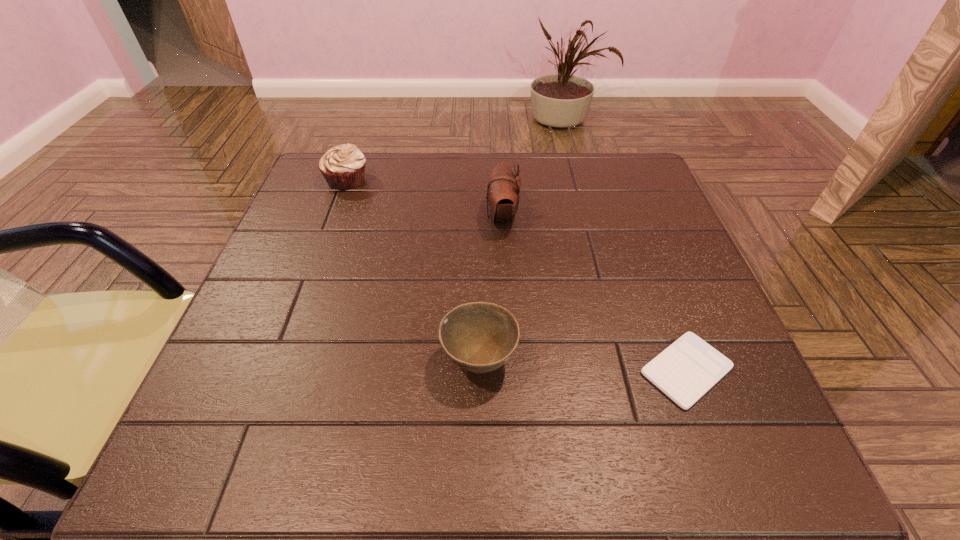
Identify the location of free space at the left edge of the desktop. The width and height of the screenshot is (960, 540). (262, 271).

The image size is (960, 540). I want to click on vacant space at the right edge of the desktop, so click(684, 326).

Identify the location of vacant space at the far left corner of the desktop. (361, 190).

The image size is (960, 540). I want to click on blank space at the near left corner of the desktop, so click(223, 468).

Where is `free area in between the tallest object and the muffin`? The image size is (960, 540). free area in between the tallest object and the muffin is located at coordinates (424, 198).

I want to click on free space between the rightmost object and the leftmost object, so click(x=516, y=275).

The height and width of the screenshot is (540, 960). What are the coordinates of `blank region between the farthest object and the bowl` in the screenshot? It's located at (413, 270).

This screenshot has height=540, width=960. What are the coordinates of `vacant point located between the calculator and the farthest object` in the screenshot? It's located at (516, 275).

The image size is (960, 540). Identify the location of free space that is in between the bowl and the second farthest object. (491, 288).

The width and height of the screenshot is (960, 540). I want to click on vacant space that's between the bowl and the third nearest object, so click(x=491, y=288).